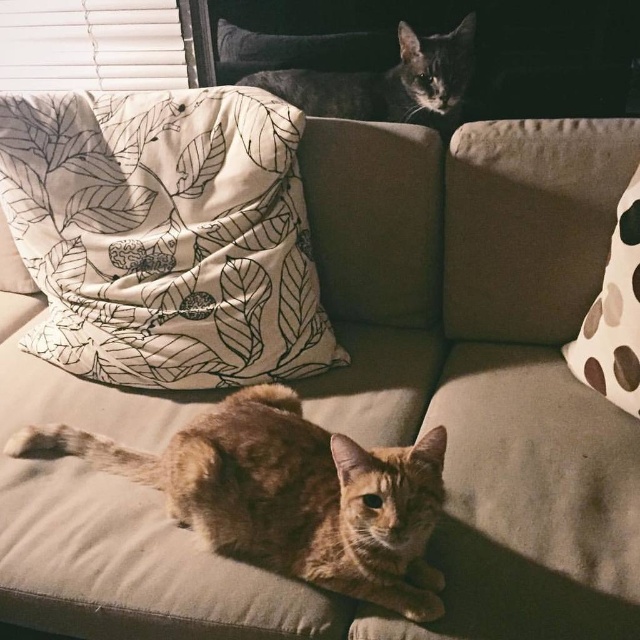
Which is behind, point (410, 81) or point (614, 337)?

Positioned behind is point (410, 81).

Does gray fur cat at upper center have a larger size compared to white dotted pillow at right?

Indeed, gray fur cat at upper center has a larger size compared to white dotted pillow at right.

Where is `gray fur cat at upper center`? This screenshot has height=640, width=640. gray fur cat at upper center is located at coordinates (387, 83).

What do you see at coordinates (289, 493) in the screenshot? I see `orange tabby cat at center` at bounding box center [289, 493].

Between point (349, 488) and point (563, 348), which one is positioned in front?

Point (349, 488)

This screenshot has height=640, width=640. Find the location of `orange tabby cat at center`. orange tabby cat at center is located at coordinates (289, 493).

Can you confirm if white fabric pillow with leaf pattern at upper left is shorter than gray fur cat at upper center?

Incorrect, white fabric pillow with leaf pattern at upper left's height does not fall short of gray fur cat at upper center's.

Based on the photo, does white fabric pillow with leaf pattern at upper left have a smaller size compared to gray fur cat at upper center?

No.

Image resolution: width=640 pixels, height=640 pixels. Describe the element at coordinates (164, 236) in the screenshot. I see `white fabric pillow with leaf pattern at upper left` at that location.

You are a GUI agent. You are given a task and a screenshot of the screen. Output one action in this format:
    pyautogui.click(x=<x>, y=<y>)
    Task: Click on the white fabric pillow with leaf pattern at upper left
    
    Given the screenshot: What is the action you would take?
    pyautogui.click(x=164, y=236)